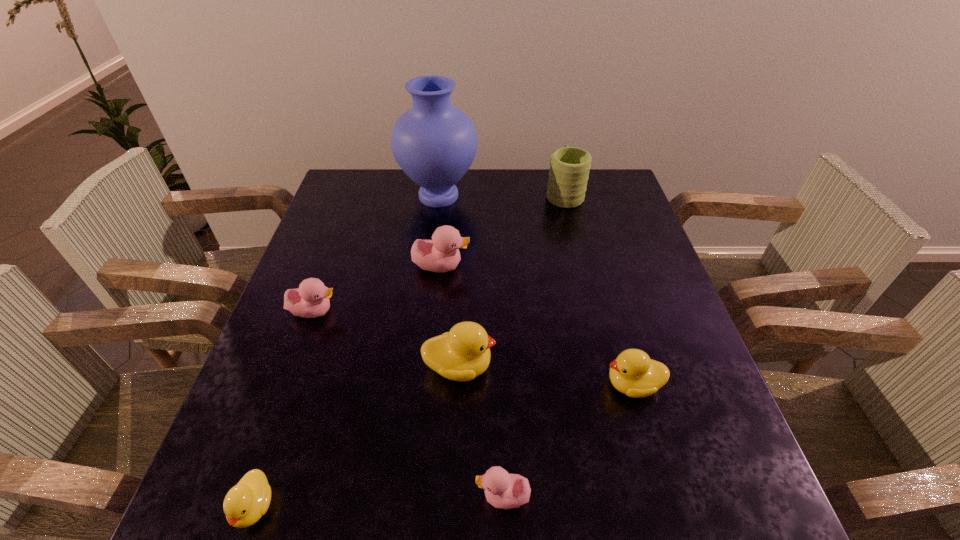
Point out which yellow duckling is positioned as the second nearest to the second farthest pink duckling. Please provide its 2D coordinates. Your answer should be formatted as a tuple, i.e. [(x, y)], where the tuple contains the x and y coordinates of a point satisfying the conditions above.

[(245, 503)]

Locate an element on the screen. This screenshot has height=540, width=960. vacant position in the image that satisfies the following two spatial constraints: 1. on the front-facing side of the biggest pink duckling; 2. on the beak of the nearest yellow duckling is located at coordinates (420, 506).

Find the location of a particular element. This screenshot has height=540, width=960. free spot that satisfies the following two spatial constraints: 1. on the beak of the second yellow duckling from right to left; 2. on the beak of the nearest yellow duckling is located at coordinates (453, 506).